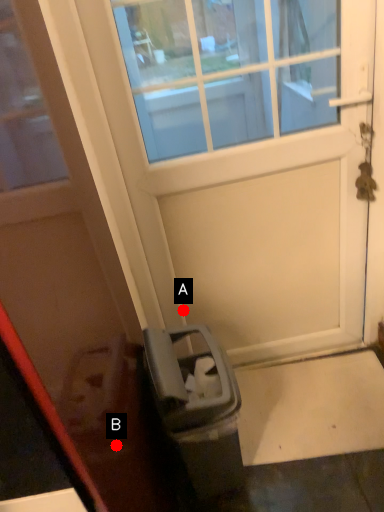
Question: Two points are circled on the image, labeled by A and B beside each circle. Which point is closer to the camera taking this photo?

Choices:
 (A) A is closer
 (B) B is closer

Answer: (B)